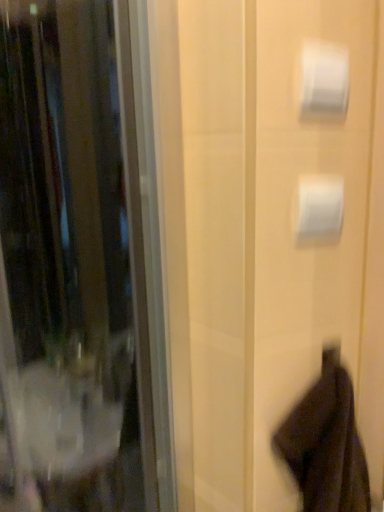
Question: From a real-world perspective, relative to white glossy toilet paper at upper right, the second toilet paper in the bottom-to-top sequence, is dark brown fabric robe at lower right vertically above or below?

Choices:
 (A) above
 (B) below

Answer: (B)

Question: In terms of size, does dark brown fabric robe at lower right appear bigger or smaller than white glossy toilet paper at upper right, the second toilet paper in the bottom-to-top sequence?

Choices:
 (A) small
 (B) big

Answer: (B)

Question: Estimate the real-world distances between objects in this image. Which object is closer to the white glossy toilet paper at upper right, which ranks as the 1th toilet paper in top-to-bottom order?

Choices:
 (A) white matte toilet paper at upper right, the second toilet paper viewed from the top
 (B) dark brown fabric robe at lower right

Answer: (A)

Question: Which object is positioned closest to the dark brown fabric robe at lower right?

Choices:
 (A) white matte toilet paper at upper right, the second toilet paper viewed from the top
 (B) white glossy toilet paper at upper right, which ranks as the 1th toilet paper in top-to-bottom order

Answer: (A)